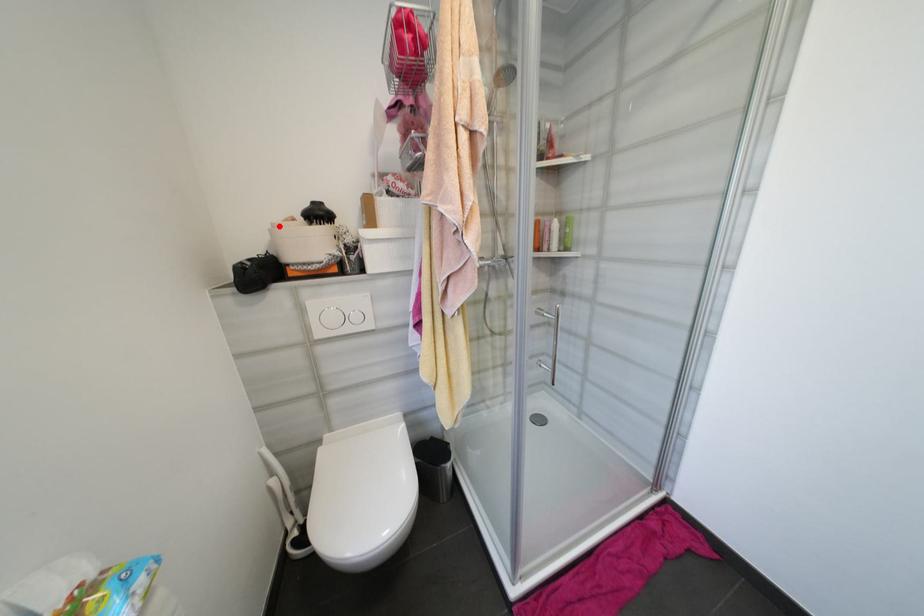
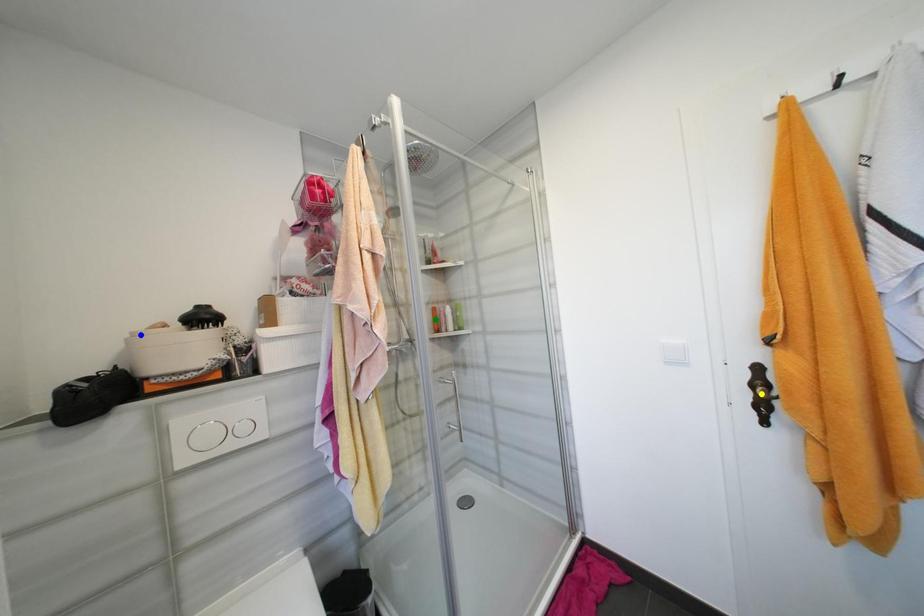
Question: I am providing you with two images of the same scene from different viewpoints. A red point is marked on the first image. You are given multiple points on the second image. Which point in image 2 is actually the same real-world point as the red point in image 1?

Choices:
 (A) blue point
 (B) green point
 (C) yellow point

Answer: (A)